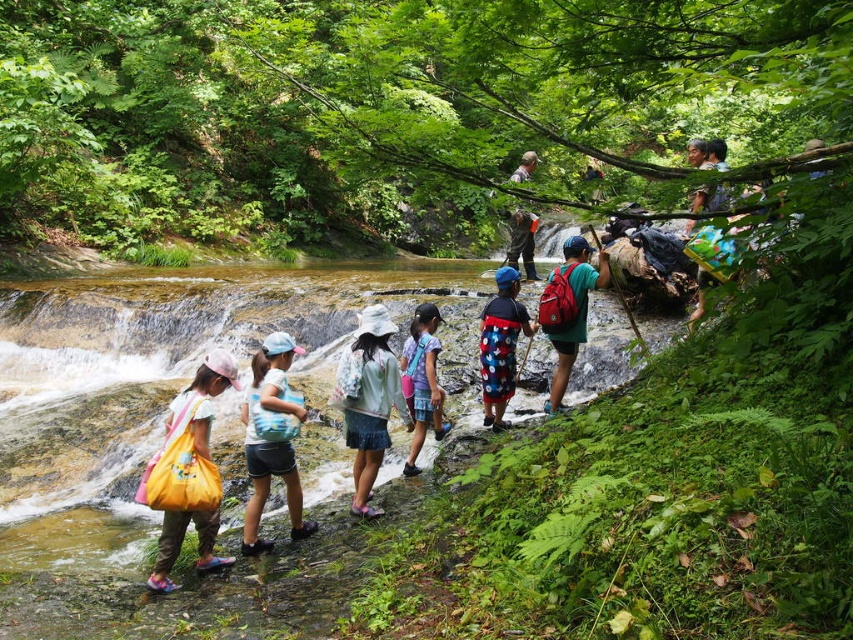
Question: Considering the real-world distances, which object is farthest from the matte green backpack at center?

Choices:
 (A) floral fabric hat at center
 (B) brown smooth stream at center

Answer: (B)

Question: Is yellow fabric bag at lower left smaller than pastel blue fabric backpack at center?

Choices:
 (A) yes
 (B) no

Answer: (A)

Question: Which point is closer to the camera taking this photo?

Choices:
 (A) (434, 365)
 (B) (561, 376)

Answer: (A)

Question: Does brown smooth stream at center appear over pastel blue fabric backpack at center?

Choices:
 (A) no
 (B) yes

Answer: (B)

Question: Can you confirm if yellow fabric bag at lower left is thinner than pastel blue fabric backpack at center?

Choices:
 (A) no
 (B) yes

Answer: (A)

Question: Among these points, which one is nearest to the camera?

Choices:
 (A) (538, 317)
 (B) (372, 272)
 (C) (250, 477)

Answer: (C)